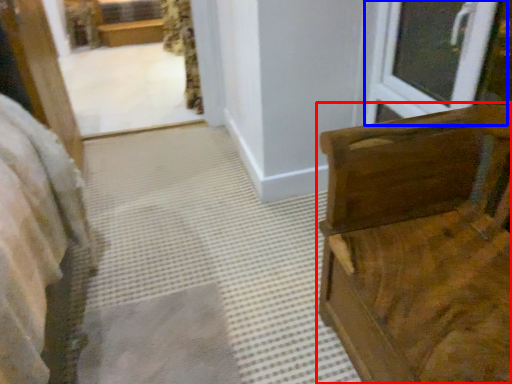
Question: Which object is closer to the camera taking this photo, furniture (highlighted by a red box) or window (highlighted by a blue box)?

Choices:
 (A) furniture
 (B) window

Answer: (A)